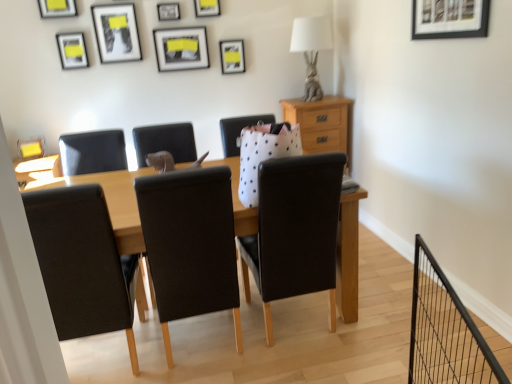
Question: Is light brown wood at upper right thinner than matte black picture frame at upper center, the second picture frame when ordered from right to left?

Choices:
 (A) no
 (B) yes

Answer: (A)

Question: From the image's perspective, is light brown wood at upper right on top of matte black picture frame at upper center, placed as the 8th picture frame when sorted from left to right?

Choices:
 (A) yes
 (B) no

Answer: (B)

Question: Can you confirm if light brown wood at upper right is positioned to the right of matte black picture frame at upper center, the 1th picture frame in the back-to-front sequence?

Choices:
 (A) yes
 (B) no

Answer: (A)

Question: Does light brown wood at upper right have a greater height compared to matte black picture frame at upper center, placed as the 8th picture frame when sorted from left to right?

Choices:
 (A) no
 (B) yes

Answer: (B)

Question: Are light brown wood at upper right and matte black picture frame at upper center, the second picture frame when ordered from right to left, far apart?

Choices:
 (A) no
 (B) yes

Answer: (A)

Question: Is light brown wood at upper right taller or shorter than matte black picture frame at upper center, the 7th picture frame viewed from the front?

Choices:
 (A) short
 (B) tall

Answer: (B)

Question: In the image, is light brown wood at upper right positioned in front of or behind matte black picture frame at upper center, which ranks as the 3th picture frame in right-to-left order?

Choices:
 (A) behind
 (B) front

Answer: (A)

Question: Considering the positions of light brown wood at upper right and matte black picture frame at upper center, the 7th picture frame from the left, in the image, is light brown wood at upper right bigger or smaller than matte black picture frame at upper center, the 7th picture frame from the left,?

Choices:
 (A) big
 (B) small

Answer: (A)

Question: From the image's perspective, is light brown wood at upper right above or below matte black picture frame at upper center, the 7th picture frame from the left?

Choices:
 (A) above
 (B) below

Answer: (B)

Question: Is point (475, 6) closer or farther from the camera than point (132, 13)?

Choices:
 (A) farther
 (B) closer

Answer: (B)

Question: Is black matte picture frame at upper right, placed as the 1th picture frame when sorted from right to left, taller or shorter than matte black picture frame at upper center, marked as the third picture frame in a front-to-back arrangement?

Choices:
 (A) short
 (B) tall

Answer: (A)

Question: Is black matte picture frame at upper right, which ranks as the ninth picture frame in left-to-right order, inside or outside of matte black picture frame at upper center, marked as the 4th picture frame in a left-to-right arrangement?

Choices:
 (A) outside
 (B) inside

Answer: (A)

Question: Considering the positions of black matte picture frame at upper right, placed as the 1th picture frame when sorted from right to left, and matte black picture frame at upper center, marked as the 4th picture frame in a left-to-right arrangement, in the image, is black matte picture frame at upper right, placed as the 1th picture frame when sorted from right to left, wider or thinner than matte black picture frame at upper center, marked as the 4th picture frame in a left-to-right arrangement,?

Choices:
 (A) wide
 (B) thin

Answer: (B)

Question: Relative to matte black picture frame at upper center, marked as the 4th picture frame in a right-to-left arrangement, is light brown wood at upper right in front or behind?

Choices:
 (A) front
 (B) behind

Answer: (B)

Question: Is light brown wood at upper right situated inside matte black picture frame at upper center, which appears as the eighth picture frame when viewed from the front, or outside?

Choices:
 (A) outside
 (B) inside

Answer: (A)